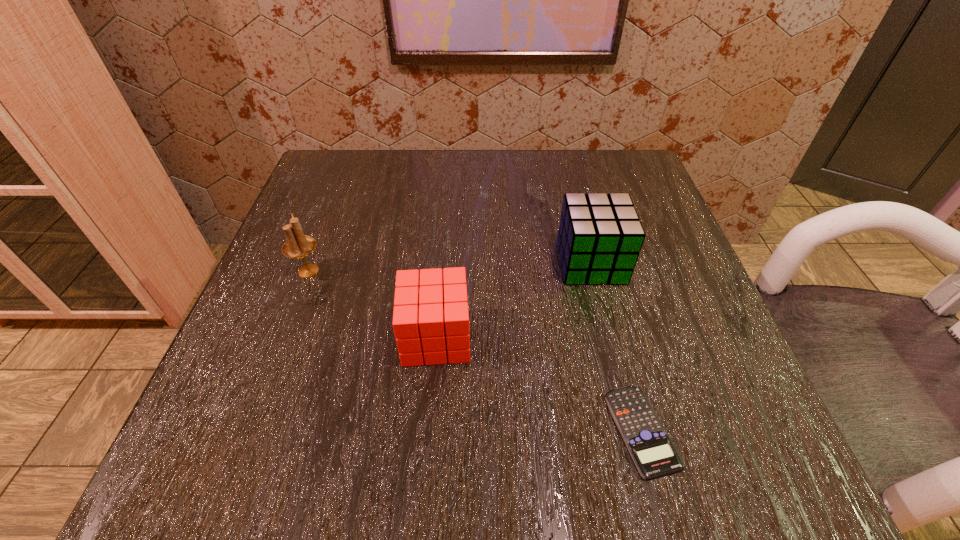
You are a GUI agent. You are given a task and a screenshot of the screen. Output one action in this format:
    pyautogui.click(x=<x>, y=<y>)
    Task: Click on the free space at the near left corner of the desktop
    The height and width of the screenshot is (540, 960).
    Given the screenshot: What is the action you would take?
    pyautogui.click(x=245, y=465)

In the image, there is a desktop. Where is `vacant area at the far right corner`? The image size is (960, 540). vacant area at the far right corner is located at coordinates (645, 206).

I want to click on vacant area at the near right corner, so click(x=710, y=457).

Locate an element on the screen. blank region between the candle holder and the left cube is located at coordinates (372, 304).

The height and width of the screenshot is (540, 960). Find the location of `empty space between the shortest object and the candle holder`. empty space between the shortest object and the candle holder is located at coordinates (475, 351).

Locate an element on the screen. Image resolution: width=960 pixels, height=540 pixels. unoccupied area between the candle holder and the calculator is located at coordinates (475, 351).

This screenshot has height=540, width=960. I want to click on free spot between the third farthest object and the leftmost object, so click(x=372, y=304).

Where is `free space between the shortest object and the candle holder`? The image size is (960, 540). free space between the shortest object and the candle holder is located at coordinates (475, 351).

Identify the location of free space between the right cube and the candle holder. (450, 267).

Image resolution: width=960 pixels, height=540 pixels. I want to click on vacant area that lies between the right cube and the nearer cube, so click(x=514, y=300).